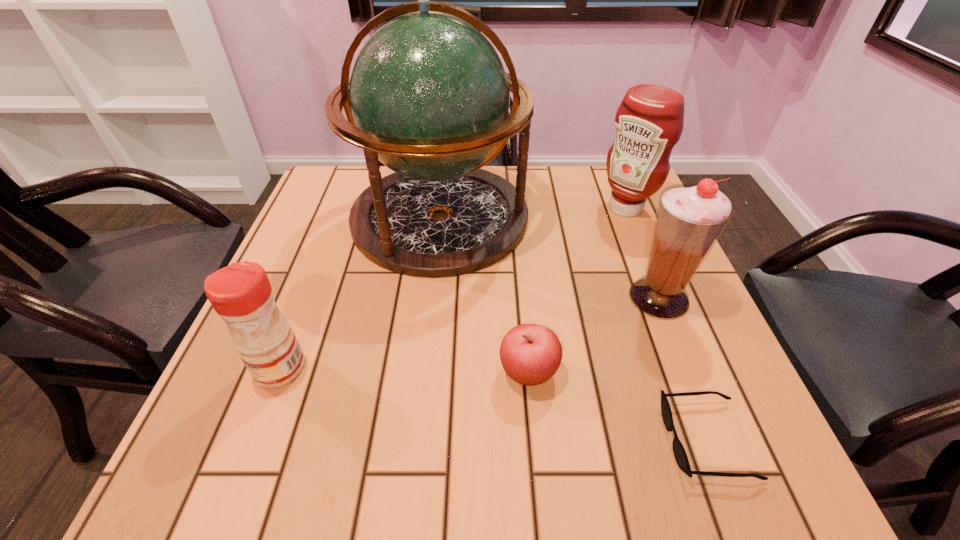
At what (x,y) coordinates should I click in order to perform the action: click on globe that is at the left edge. Please return your answer as a coordinate pair (x, y). The image size is (960, 540). Looking at the image, I should click on (429, 97).

Where is `condiment present at the left edge`? condiment present at the left edge is located at coordinates (241, 294).

At what (x,y) coordinates should I click in order to perform the action: click on condiment located at the right edge. Please return your answer as a coordinate pair (x, y). Image resolution: width=960 pixels, height=540 pixels. Looking at the image, I should click on pos(649,121).

Where is `smoothie present at the right edge`? smoothie present at the right edge is located at coordinates (690, 218).

This screenshot has width=960, height=540. I want to click on sunglasses present at the right edge, so click(680, 455).

Image resolution: width=960 pixels, height=540 pixels. What are the coordinates of `object situated at the far left corner` in the screenshot? It's located at (429, 97).

Locate an element on the screen. The image size is (960, 540). object present at the far right corner is located at coordinates (649, 121).

Find the location of a particular element. object that is at the near right corner is located at coordinates (680, 455).

At what (x,y) coordinates should I click in order to perform the action: click on vacant space at the far edge. Please return your answer as a coordinate pair (x, y). Looking at the image, I should click on (557, 184).

Where is `blank space at the near edge of the desktop`? blank space at the near edge of the desktop is located at coordinates (593, 485).